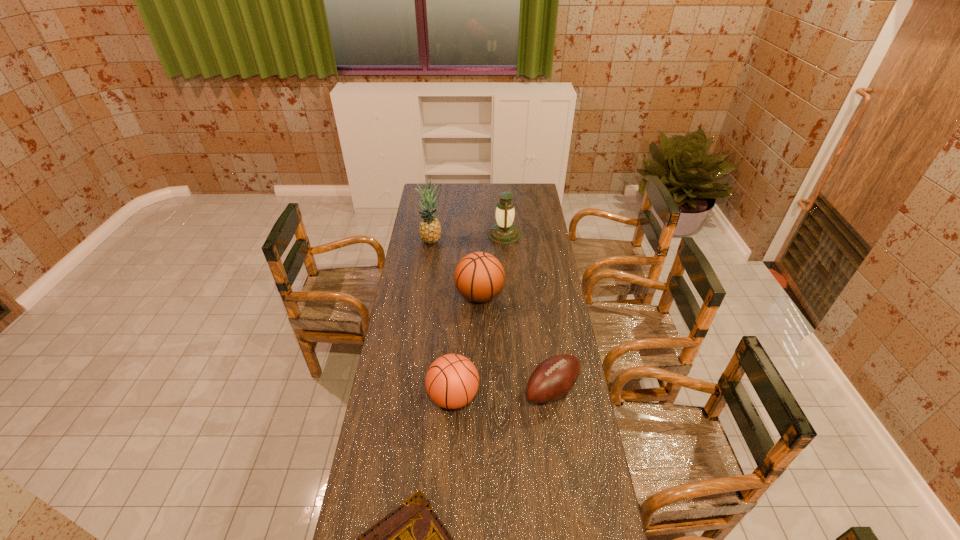
This screenshot has width=960, height=540. What are the coordinates of `vacant point located between the shorter basketball and the lantern` in the screenshot? It's located at (479, 316).

Locate an element on the screen. This screenshot has height=540, width=960. vacant space in between the tallest object and the farther basketball is located at coordinates (455, 268).

Locate an element on the screen. The width and height of the screenshot is (960, 540). vacant area that lies between the lantern and the shorter basketball is located at coordinates (479, 316).

Identify the location of vacant area between the farther basketball and the pineapple. (455, 268).

The height and width of the screenshot is (540, 960). Find the location of `free space between the shorter basketball and the tallest object`. free space between the shorter basketball and the tallest object is located at coordinates (442, 319).

This screenshot has height=540, width=960. I want to click on unoccupied position between the pineapple and the third farthest object, so coord(455,268).

The height and width of the screenshot is (540, 960). What are the coordinates of `object that is the fifth closest one to the farther basketball` in the screenshot? It's located at (411, 539).

Choose which object is the fourth nearest neighbor to the nearest object. Please provide its 2D coordinates. Your answer should be formatted as a tuple, i.e. [(x, y)], where the tuple contains the x and y coordinates of a point satisfying the conditions above.

[(429, 228)]

Locate an element on the screen. The image size is (960, 540). free region that satisfies the following two spatial constraints: 1. on the front side of the pineapple; 2. on the right side of the fourth tallest object is located at coordinates (409, 397).

Where is `free space that satisfies the following two spatial constraints: 1. on the front side of the pineapple; 2. on the left side of the nearer basketball`? This screenshot has height=540, width=960. free space that satisfies the following two spatial constraints: 1. on the front side of the pineapple; 2. on the left side of the nearer basketball is located at coordinates (409, 397).